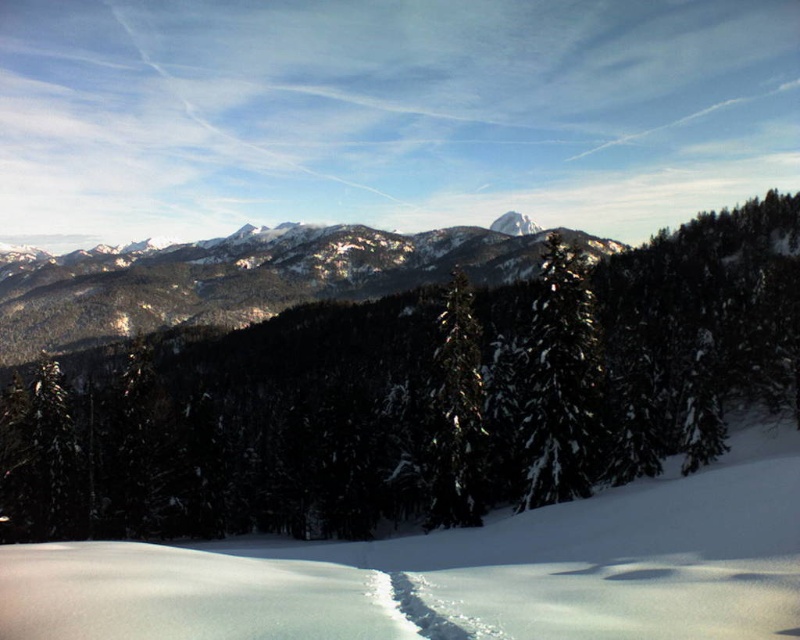
Is green textured pine tree at center thinner than snowy rocky mountain at center?

Correct, green textured pine tree at center's width is less than snowy rocky mountain at center's.

Does point (400, 464) come in front of point (508, 257)?

Yes, it is in front of point (508, 257).

Is point (172, 330) positioned in front of point (506, 241)?

Yes, it is in front of point (506, 241).

The height and width of the screenshot is (640, 800). I want to click on green textured pine tree at center, so click(x=414, y=396).

Is white snow at center smaller than green glossy tree at center?

No, white snow at center is not smaller than green glossy tree at center.

Is point (710, 516) positioned behind point (462, 499)?

No.

Is point (698, 579) behind point (458, 333)?

No, (698, 579) is closer to viewer.

This screenshot has width=800, height=640. What are the coordinates of `white snow at center` in the screenshot? It's located at (458, 572).

Can you confirm if white snow at center is smaller than snowy rocky mountain at center?

Yes, white snow at center is smaller than snowy rocky mountain at center.

Who is higher up, white snow at center or snowy rocky mountain at center?

snowy rocky mountain at center is higher up.

Which is in front, point (642, 554) or point (97, 330)?

Positioned in front is point (642, 554).

At what (x,y) coordinates should I click in order to perform the action: click on white snow at center. Please return your answer as a coordinate pair (x, y). This screenshot has height=640, width=800. Looking at the image, I should click on (458, 572).